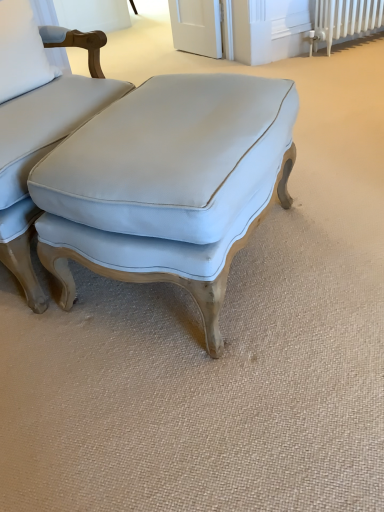
Question: From a real-world perspective, is light blue fabric ottoman at center on white fabric pillow at upper left?

Choices:
 (A) no
 (B) yes

Answer: (A)

Question: Is light blue fabric ottoman at center oriented away from white fabric pillow at upper left?

Choices:
 (A) no
 (B) yes

Answer: (A)

Question: Is the surface of light blue fabric ottoman at center in direct contact with white fabric pillow at upper left?

Choices:
 (A) no
 (B) yes

Answer: (A)

Question: Considering the relative sizes of light blue fabric ottoman at center and white fabric pillow at upper left in the image provided, is light blue fabric ottoman at center taller than white fabric pillow at upper left?

Choices:
 (A) yes
 (B) no

Answer: (A)

Question: From a real-world perspective, is light blue fabric ottoman at center physically below white fabric pillow at upper left?

Choices:
 (A) yes
 (B) no

Answer: (A)

Question: Can we say light blue fabric ottoman at center lies outside white fabric pillow at upper left?

Choices:
 (A) yes
 (B) no

Answer: (A)

Question: Is matte white cushion at center closer to the viewer compared to white fabric pillow at upper left?

Choices:
 (A) no
 (B) yes

Answer: (B)

Question: Is white fabric pillow at upper left at the back of matte white cushion at center?

Choices:
 (A) yes
 (B) no

Answer: (B)

Question: Is matte white cushion at center placed right next to white fabric pillow at upper left?

Choices:
 (A) yes
 (B) no

Answer: (B)

Question: From the image's perspective, is matte white cushion at center below white fabric pillow at upper left?

Choices:
 (A) yes
 (B) no

Answer: (A)

Question: Does matte white cushion at center have a lesser width compared to white fabric pillow at upper left?

Choices:
 (A) no
 (B) yes

Answer: (A)

Question: Is matte white cushion at center smaller than white fabric pillow at upper left?

Choices:
 (A) no
 (B) yes

Answer: (A)

Question: Is light blue fabric ottoman at center far from matte white cushion at center?

Choices:
 (A) no
 (B) yes

Answer: (A)